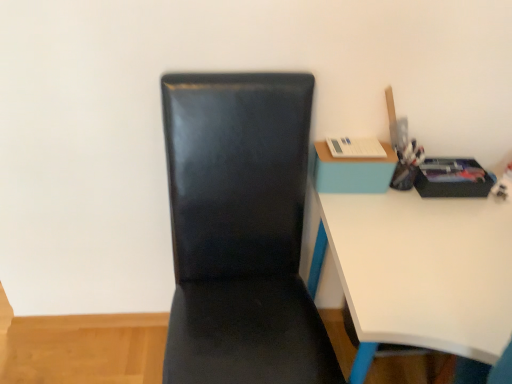
The image size is (512, 384). Describe the element at coordinates (240, 231) in the screenshot. I see `black leather chair at center` at that location.

This screenshot has height=384, width=512. Find the location of `white glossy desk at right`. white glossy desk at right is located at coordinates (414, 265).

Is black leather chair at center thinner than blue matte table at upper right?

No.

Is black leather chair at center turned away from blue matte table at upper right?

No, black leather chair at center is not facing away from blue matte table at upper right.

Measure the distance between black leather chair at center and blue matte table at upper right.

They are 12.73 inches apart.

From the picture: Which object is closer to the camera, black leather chair at center or blue matte table at upper right?

black leather chair at center is in front.

Who is bigger, white glossy desk at right or blue matte table at upper right?

Bigger between the two is white glossy desk at right.

Could you tell me if white glossy desk at right is facing blue matte table at upper right?

No, white glossy desk at right is not oriented towards blue matte table at upper right.

Which is closer to the camera, [399,321] or [355,172]?

Point [399,321] is closer to the camera than point [355,172].

From a real-world perspective, relative to blue matte table at upper right, is white glossy desk at right vertically above or below?

white glossy desk at right is below blue matte table at upper right.

Can you confirm if blue matte table at upper right is positioned to the right of black leather chair at center?

Yes.

In the image, there is a blue matte table at upper right. Where is `chair below it (from the image's perspective)`? Image resolution: width=512 pixels, height=384 pixels. chair below it (from the image's perspective) is located at coordinates (240, 231).

Looking at their sizes, would you say blue matte table at upper right is wider or thinner than black leather chair at center?

blue matte table at upper right is thinner than black leather chair at center.

Considering the sizes of objects blue matte table at upper right and black leather chair at center in the image provided, who is smaller, blue matte table at upper right or black leather chair at center?

With smaller size is blue matte table at upper right.

Is white glossy desk at right next to black leather chair at center?

No, white glossy desk at right is not beside black leather chair at center.

Is the depth of white glossy desk at right less than that of black leather chair at center?

No, the depth of white glossy desk at right is greater than that of black leather chair at center.

Considering the sizes of white glossy desk at right and black leather chair at center in the image, is white glossy desk at right bigger or smaller than black leather chair at center?

white glossy desk at right is bigger than black leather chair at center.

Where is `desk located underneath the black leather chair at center (from a real-world perspective)`? The width and height of the screenshot is (512, 384). desk located underneath the black leather chair at center (from a real-world perspective) is located at coordinates (414, 265).

Can we say black leather chair at center lies outside white glossy desk at right?

Yes.

Looking at this image, from the image's perspective, is black leather chair at center positioned above or below white glossy desk at right?

black leather chair at center is above white glossy desk at right.

Is black leather chair at center facing towards white glossy desk at right?

No, black leather chair at center does not turn towards white glossy desk at right.

Does black leather chair at center have a smaller size compared to white glossy desk at right?

Correct, black leather chair at center occupies less space than white glossy desk at right.

Considering the relative positions of blue matte table at upper right and white glossy desk at right in the image provided, is blue matte table at upper right to the right of white glossy desk at right from the viewer's perspective?

No, blue matte table at upper right is not to the right of white glossy desk at right.

From the image's perspective, is blue matte table at upper right under white glossy desk at right?

Actually, blue matte table at upper right appears above white glossy desk at right in the image.

Is blue matte table at upper right outside of white glossy desk at right?

Yes, blue matte table at upper right is not within white glossy desk at right.

Which object is wider, blue matte table at upper right or white glossy desk at right?

With larger width is white glossy desk at right.

This screenshot has width=512, height=384. Identify the location of chair lying on the left of blue matte table at upper right. (240, 231).

Locate an element on the screen. The width and height of the screenshot is (512, 384). table above the white glossy desk at right (from the image's perspective) is located at coordinates (352, 171).

From the image, which object appears to be nearer to white glossy desk at right, black leather chair at center or blue matte table at upper right?

blue matte table at upper right.

Estimate the real-world distances between objects in this image. Which object is closer to white glossy desk at right, blue matte table at upper right or black leather chair at center?

blue matte table at upper right is closer to white glossy desk at right.

Which object lies further to the anchor point blue matte table at upper right, white glossy desk at right or black leather chair at center?

Based on the image, black leather chair at center appears to be further to blue matte table at upper right.

When comparing their distances from black leather chair at center, does blue matte table at upper right or white glossy desk at right seem further?

blue matte table at upper right is further to black leather chair at center.

Estimate the real-world distances between objects in this image. Which object is closer to black leather chair at center, white glossy desk at right or blue matte table at upper right?

The object closer to black leather chair at center is white glossy desk at right.

Considering their positions, is black leather chair at center positioned closer to blue matte table at upper right than white glossy desk at right?

The object closer to blue matte table at upper right is white glossy desk at right.

Locate an element on the screen. This screenshot has width=512, height=384. table between black leather chair at center and white glossy desk at right from left to right is located at coordinates (352, 171).